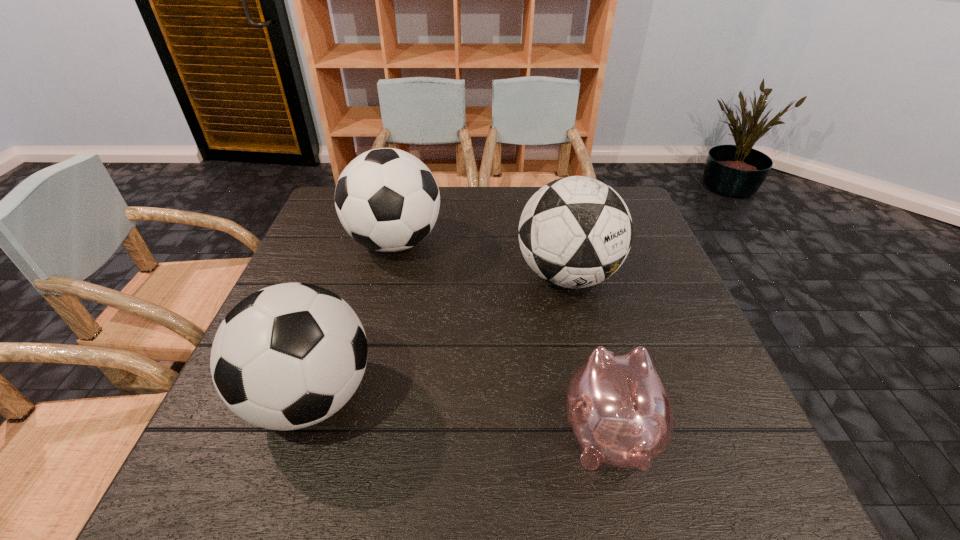
Identify the location of free area in between the piggy bank and the nearest soccer ball. (460, 414).

You are a GUI agent. You are given a task and a screenshot of the screen. Output one action in this format:
    pyautogui.click(x=<x>, y=<y>)
    Task: Click on the free space between the piggy bank and the nearest soccer ball
    Image resolution: width=960 pixels, height=540 pixels.
    Given the screenshot: What is the action you would take?
    pyautogui.click(x=460, y=414)

Locate an element on the screen. The image size is (960, 540). vacant area between the nearest soccer ball and the piggy bank is located at coordinates (460, 414).

Identify the location of empty location between the rightmost soccer ball and the nearest soccer ball. (439, 336).

Locate which object is the closest to the shortest object. Please provide its 2D coordinates. Your answer should be formatted as a tuple, i.e. [(x, y)], where the tuple contains the x and y coordinates of a point satisfying the conditions above.

[(574, 232)]

You are a GUI agent. You are given a task and a screenshot of the screen. Output one action in this format:
    pyautogui.click(x=<x>, y=<y>)
    Task: Click on the object that stands as the third closest to the rightmost soccer ball
    The image size is (960, 540).
    Given the screenshot: What is the action you would take?
    pyautogui.click(x=288, y=356)

Identify the location of soccer ball that stands as the closest to the nearest soccer ball. The height and width of the screenshot is (540, 960). (387, 200).

Locate which soccer ball is the second closest to the nearest soccer ball. Please provide its 2D coordinates. Your answer should be formatted as a tuple, i.e. [(x, y)], where the tuple contains the x and y coordinates of a point satisfying the conditions above.

[(574, 232)]